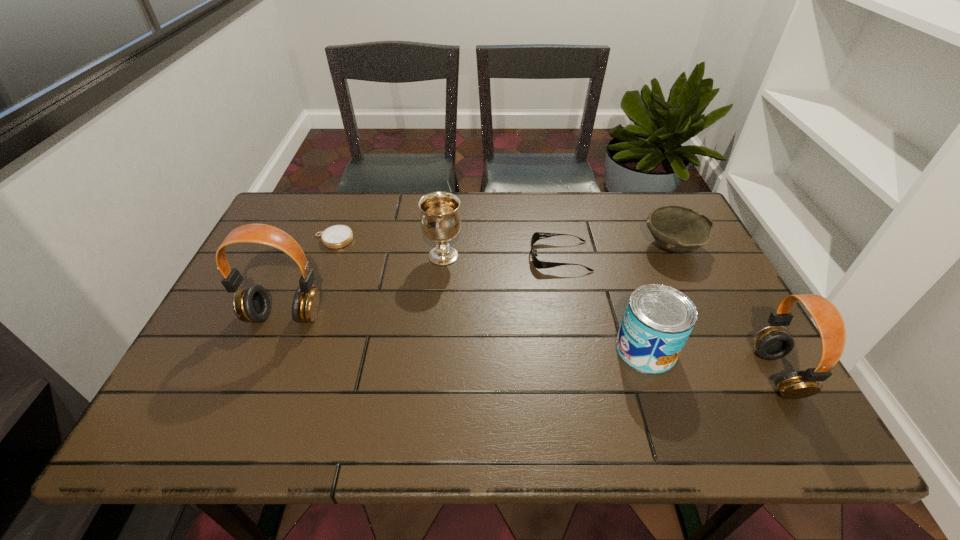
Where is `bowl that is positioned at the far edge`? bowl that is positioned at the far edge is located at coordinates (679, 229).

Image resolution: width=960 pixels, height=540 pixels. Identify the location of compass at the far edge. (338, 236).

In order to click on headset situated at the near edge in this screenshot , I will do `click(771, 343)`.

The height and width of the screenshot is (540, 960). What are the coordinates of `can present at the near edge` in the screenshot? It's located at (658, 320).

At what (x,y) coordinates should I click in order to perform the action: click on headset that is at the left edge. Please return your answer as a coordinate pair (x, y). This screenshot has width=960, height=540. Looking at the image, I should click on (252, 303).

Locate an element on the screen. compass that is positioned at the left edge is located at coordinates (338, 236).

Where is `headset present at the right edge`? headset present at the right edge is located at coordinates (771, 343).

Identify the location of bowl that is at the right edge. (679, 229).

You are a GUI agent. You are given a task and a screenshot of the screen. Output one action in this format:
    pyautogui.click(x=<x>, y=<y>)
    Task: Click on the object that is at the far left corner
    The width and height of the screenshot is (960, 540).
    Given the screenshot: What is the action you would take?
    pyautogui.click(x=338, y=236)

What are the coordinates of `object at the far right corner` in the screenshot? It's located at (679, 229).